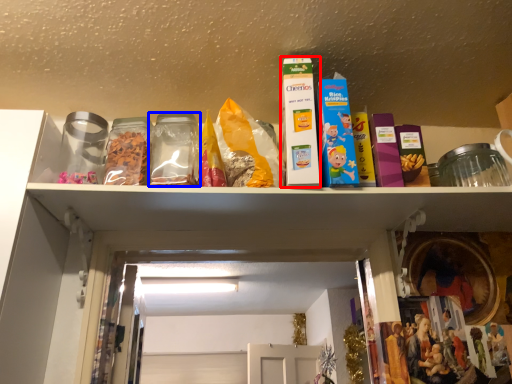
Question: Which object is further to the camera taking this photo, product (highlighted by a red box) or glass jar (highlighted by a blue box)?

Choices:
 (A) product
 (B) glass jar

Answer: (B)